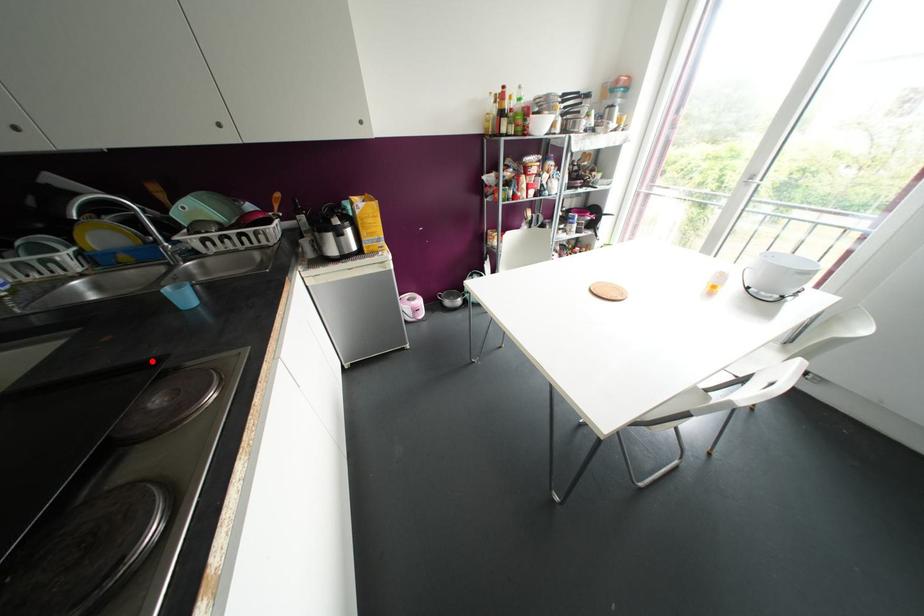
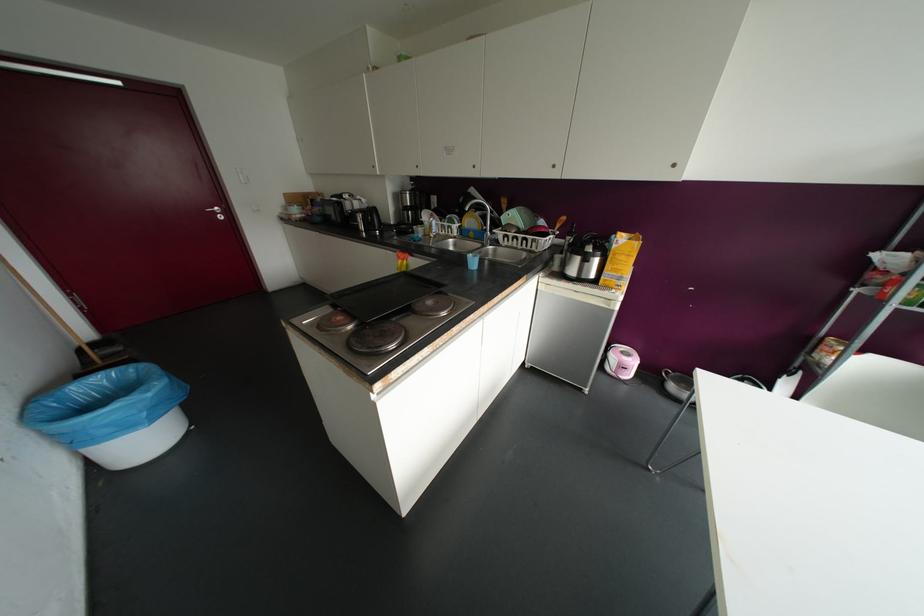
Find the pixel in the second image that matches the highlighted location in the first image.

(441, 284)